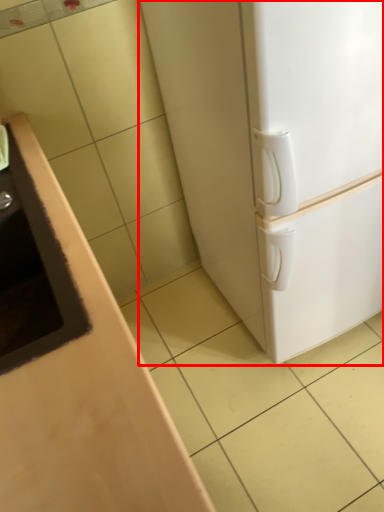
Question: From the image's perspective, what is the correct spatial positioning of refrigerator (annotated by the red box) in reference to sink?

Choices:
 (A) below
 (B) above

Answer: (B)